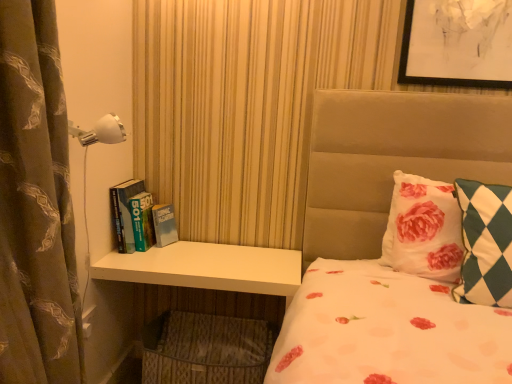
Locate an element on the screen. This screenshot has height=384, width=512. free space in front of green matte book at left is located at coordinates coord(135,264).